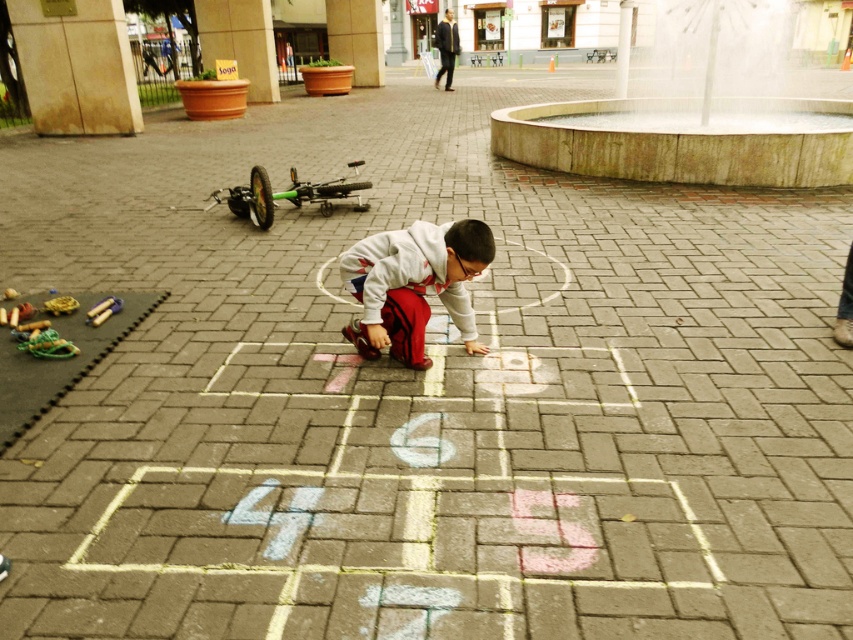
You are a photographer setting up a tripod in the plaza. You want to capture both the stone fountain at center and the white fleece jacket at center in your shot. Which object will appear larger in the photo?

The stone fountain at center will appear larger in the photo because it is bigger than the white fleece jacket at center.

You are a photographer standing in the plaza and want to capture both the stone fountain at center and the white fleece jacket at center in the same frame. Based on their positions, which object should you position closer to the left side of your camera view?

The white fleece jacket at center should be positioned closer to the left side of your camera view because the stone fountain at center is to the right of it.